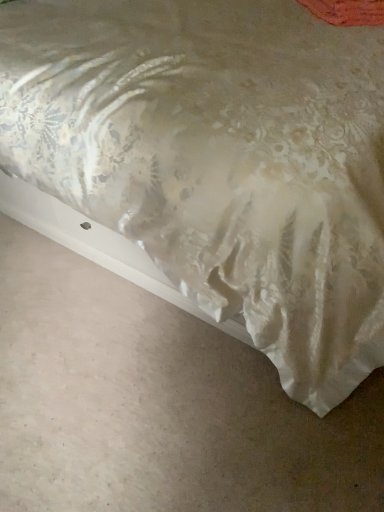
Where is `white glossy concrete at center`? The width and height of the screenshot is (384, 512). white glossy concrete at center is located at coordinates [x=157, y=404].

What do you see at coordinates (157, 404) in the screenshot? The image size is (384, 512). I see `white glossy concrete at center` at bounding box center [157, 404].

Find the location of a particular element. This screenshot has width=384, height=512. white glossy concrete at center is located at coordinates (157, 404).